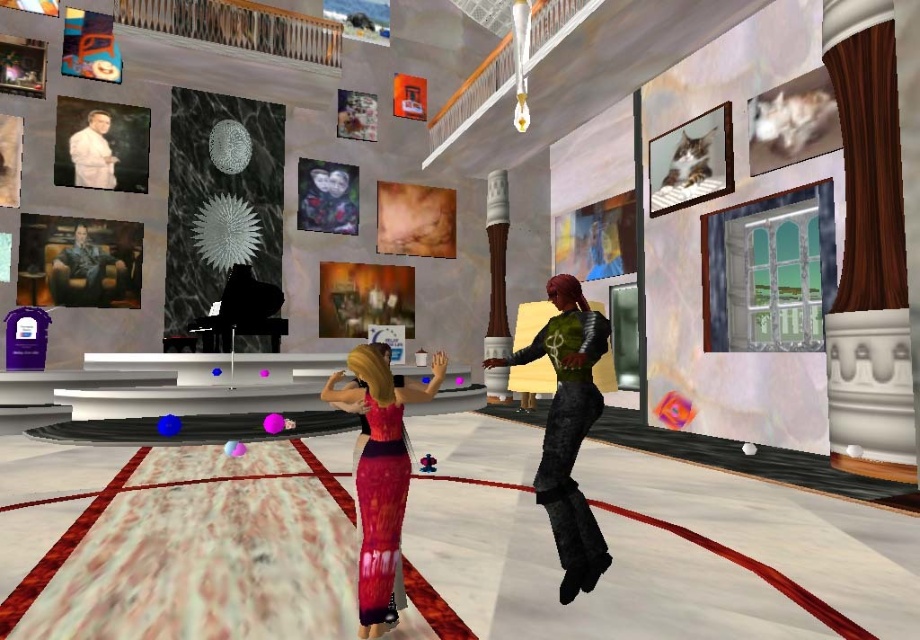
Question: Observing the image, what is the correct spatial positioning of green metallic armor at center in reference to knitted pink dress at center?

Choices:
 (A) left
 (B) right

Answer: (B)

Question: Which of the following is the farthest from the observer?

Choices:
 (A) knitted pink dress at center
 (B) green metallic armor at center
 (C) white matte suit at upper left

Answer: (C)

Question: Estimate the real-world distances between objects in this image. Which object is farther from the white matte suit at upper left?

Choices:
 (A) green metallic armor at center
 (B) knitted pink dress at center

Answer: (A)

Question: Is knitted pink dress at center behind white matte suit at upper left?

Choices:
 (A) no
 (B) yes

Answer: (A)

Question: Which of these objects is positioned farthest from the green metallic armor at center?

Choices:
 (A) white matte suit at upper left
 (B) knitted pink dress at center

Answer: (A)

Question: Is green metallic armor at center positioned in front of knitted pink dress at center?

Choices:
 (A) yes
 (B) no

Answer: (B)